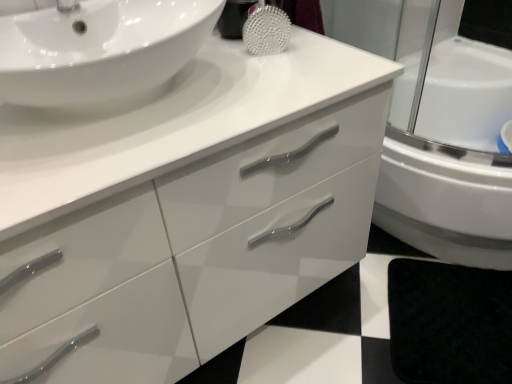
I want to click on vacant area on top of black matte bath mat at lower right (from a real-world perspective), so click(x=470, y=303).